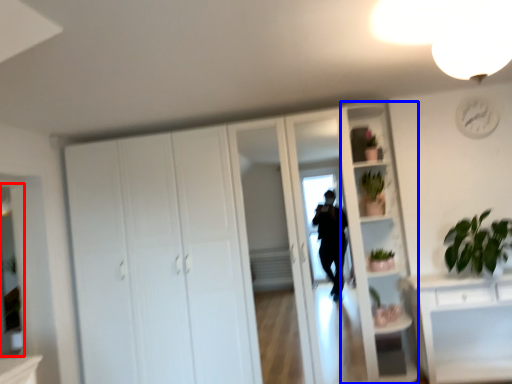
Question: Among these objects, which one is farthest to the camera, mirror (highlighted by a red box) or bookshelf (highlighted by a blue box)?

Choices:
 (A) mirror
 (B) bookshelf

Answer: (B)